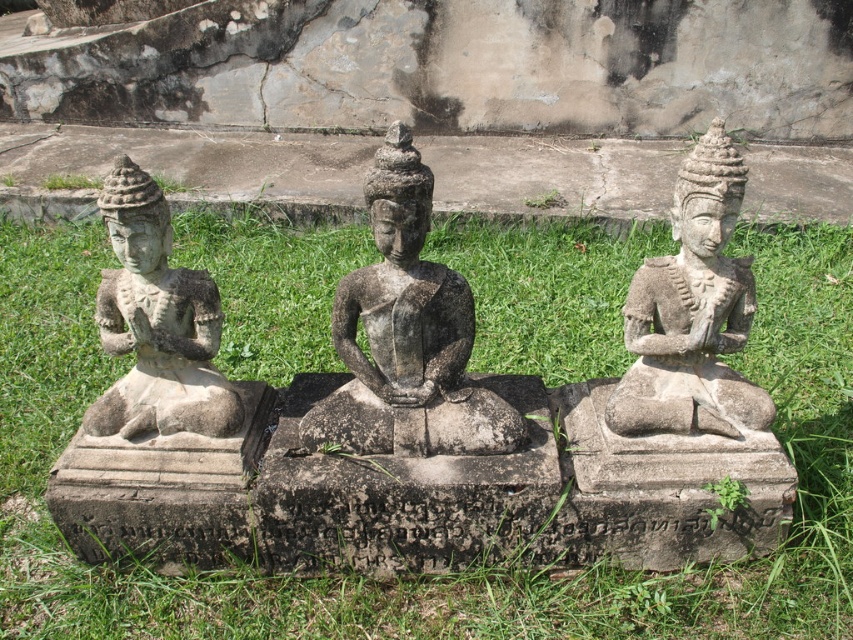
Can you confirm if green grass at center is bigger than gray stone statue at left?

Indeed, green grass at center has a larger size compared to gray stone statue at left.

Who is more forward, (606, 234) or (146, 241)?

Point (146, 241) is in front.

Identify the location of green grass at center. (427, 577).

Between gray stone statue at center and stone statue at right, which one has less height?

Standing shorter between the two is stone statue at right.

Is point (471, 416) farther from camera compared to point (689, 280)?

Yes, point (471, 416) is farther from viewer.

Find the location of `gray stone statue at center`. gray stone statue at center is located at coordinates (407, 337).

Can you confirm if green grass at center is positioned to the left of stone statue at right?

Indeed, green grass at center is positioned on the left side of stone statue at right.

You are a GUI agent. You are given a task and a screenshot of the screen. Output one action in this format:
    pyautogui.click(x=<x>, y=<y>)
    Task: Click on the green grass at center
    
    Given the screenshot: What is the action you would take?
    pyautogui.click(x=427, y=577)

Is point (614, 582) positioned before point (637, 388)?

No, it is behind (637, 388).

The width and height of the screenshot is (853, 640). What are the coordinates of `green grass at center` in the screenshot? It's located at (427, 577).